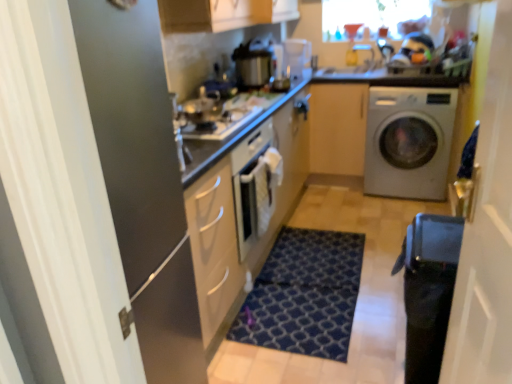
Question: Is metallic silver pot at center thinner than black glossy water heater at lower right?

Choices:
 (A) yes
 (B) no

Answer: (A)

Question: From a real-world perspective, is metallic silver pot at center physically above black glossy water heater at lower right?

Choices:
 (A) yes
 (B) no

Answer: (A)

Question: From a real-world perspective, is metallic silver pot at center below black glossy water heater at lower right?

Choices:
 (A) no
 (B) yes

Answer: (A)

Question: Considering the relative positions of metallic silver pot at center and black glossy water heater at lower right in the image provided, is metallic silver pot at center to the left of black glossy water heater at lower right from the viewer's perspective?

Choices:
 (A) no
 (B) yes

Answer: (B)

Question: Does metallic silver pot at center come behind black glossy water heater at lower right?

Choices:
 (A) no
 (B) yes

Answer: (B)

Question: In terms of size, does satin silver washing machine at right appear bigger or smaller than metallic silver pot at center?

Choices:
 (A) big
 (B) small

Answer: (A)

Question: From a real-world perspective, is satin silver washing machine at right positioned above or below metallic silver pot at center?

Choices:
 (A) above
 (B) below

Answer: (B)

Question: Considering the positions of satin silver washing machine at right and metallic silver pot at center in the image, is satin silver washing machine at right taller or shorter than metallic silver pot at center?

Choices:
 (A) short
 (B) tall

Answer: (B)

Question: Would you say satin silver washing machine at right is inside or outside metallic silver pot at center?

Choices:
 (A) inside
 (B) outside

Answer: (B)

Question: From the image's perspective, is dark blue textured rug at center above or below black glossy water heater at lower right?

Choices:
 (A) below
 (B) above

Answer: (A)

Question: Considering the positions of dark blue textured rug at center and black glossy water heater at lower right in the image, is dark blue textured rug at center wider or thinner than black glossy water heater at lower right?

Choices:
 (A) wide
 (B) thin

Answer: (A)

Question: Is dark blue textured rug at center spatially inside black glossy water heater at lower right, or outside of it?

Choices:
 (A) outside
 (B) inside

Answer: (A)

Question: Is point (338, 289) closer or farther from the camera than point (414, 379)?

Choices:
 (A) farther
 (B) closer

Answer: (A)

Question: In the image, is transparent glass window screen at upper center positioned in front of or behind satin silver washing machine at right?

Choices:
 (A) behind
 (B) front

Answer: (A)

Question: Based on their sizes in the image, would you say transparent glass window screen at upper center is bigger or smaller than satin silver washing machine at right?

Choices:
 (A) big
 (B) small

Answer: (B)